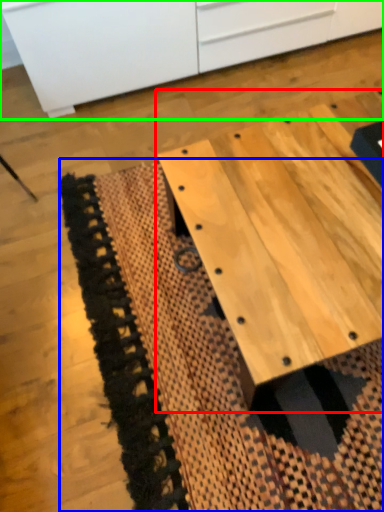
Question: Estimate the real-world distances between objects in this image. Which object is farther from table (highlighted by a red box), mat (highlighted by a blue box) or cabinetry (highlighted by a green box)?

Choices:
 (A) mat
 (B) cabinetry

Answer: (B)